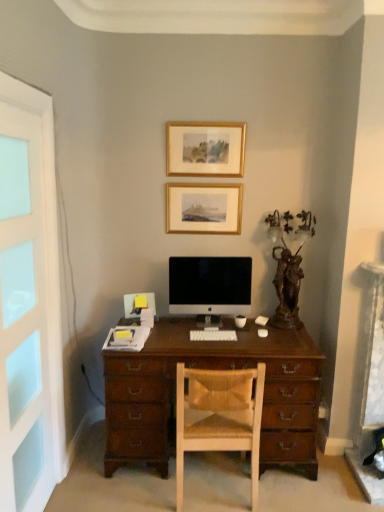
At what (x,y) coordinates should I click in order to perform the action: click on free region under gold/glossy picture frame at upper center, which is counted as the second picture frame, starting from the bottom (from a real-world perspective). Please return your answer as a coordinate pair (x, y). The width and height of the screenshot is (384, 512). Looking at the image, I should click on (210, 177).